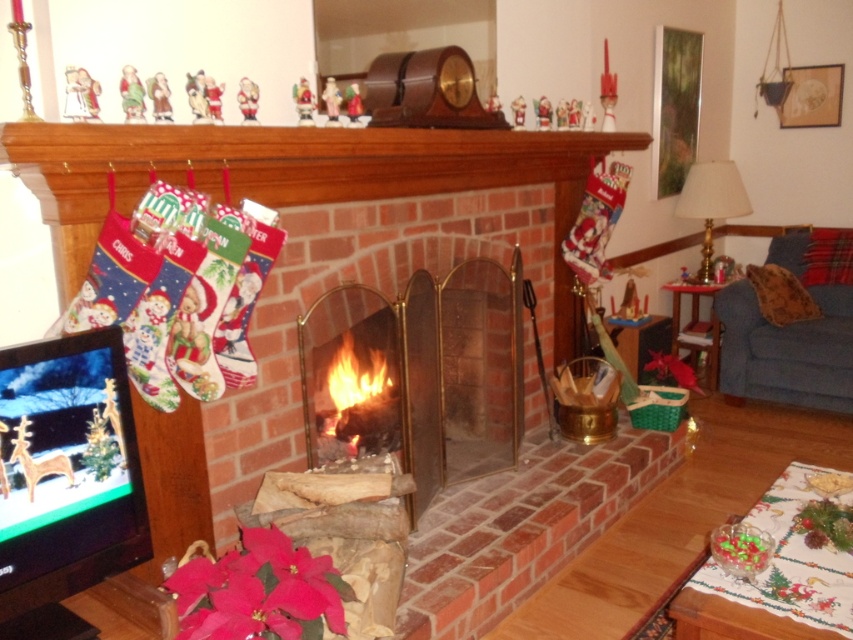
Question: Which point is closer to the camera?

Choices:
 (A) (726, 298)
 (B) (173, 580)
 (C) (167, 445)

Answer: (B)

Question: Which object is positioned farthest from the blue fabric couch at lower right?

Choices:
 (A) pink matte poinsettia at lower left
 (B) brick fireplace at center

Answer: (A)

Question: Does brick fireplace at center appear on the right side of pink matte poinsettia at lower left?

Choices:
 (A) no
 (B) yes

Answer: (B)

Question: Does brick fireplace at center have a smaller size compared to pink matte poinsettia at lower left?

Choices:
 (A) yes
 (B) no

Answer: (B)

Question: Is pink matte poinsettia at lower left positioned before blue fabric couch at lower right?

Choices:
 (A) no
 (B) yes

Answer: (B)

Question: Which point appears closest to the camera in this image?

Choices:
 (A) (61, 202)
 (B) (830, 388)
 (C) (320, 636)

Answer: (C)